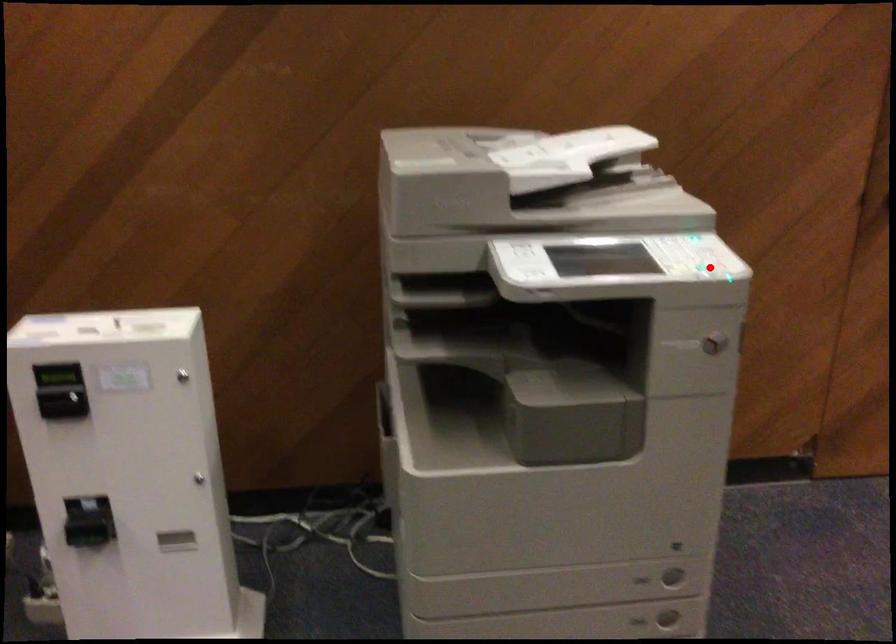
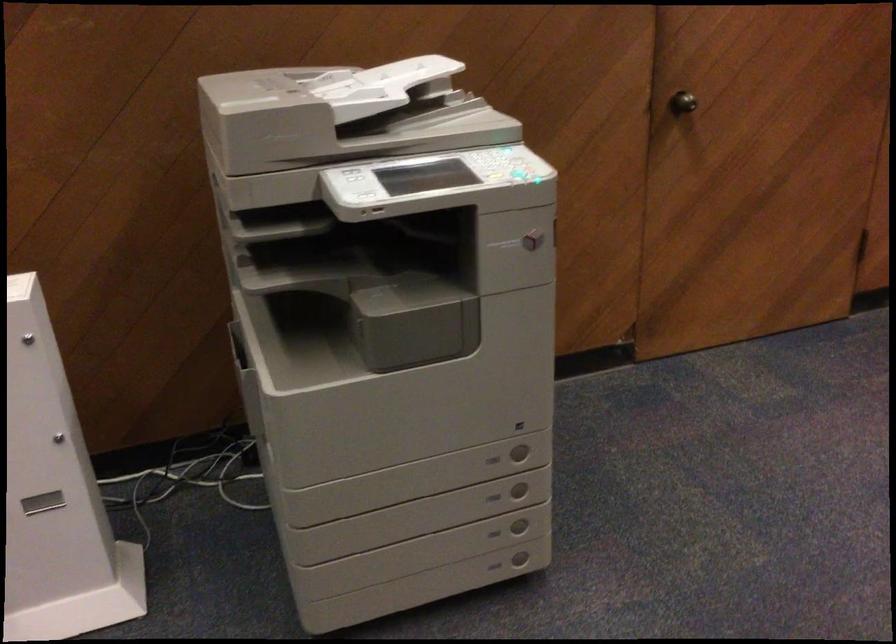
Locate, in the second image, the point that corresponds to the highlighted location in the first image.

(521, 176)